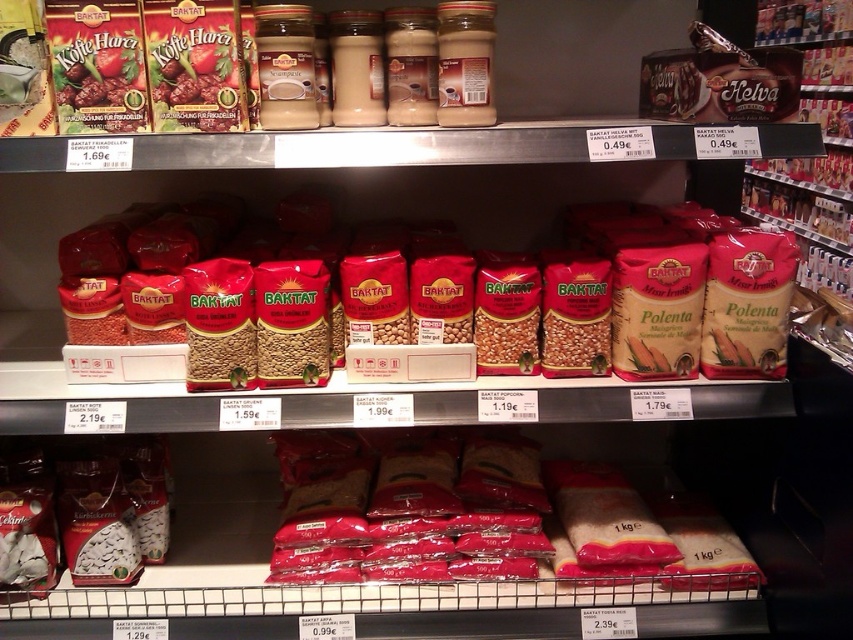
Question: Does red matte beans at center have a smaller size compared to red matte rice at center?

Choices:
 (A) no
 (B) yes

Answer: (A)

Question: Which object is farther from the camera taking this photo?

Choices:
 (A) red matte beans at center
 (B) red matte rice at center

Answer: (B)

Question: Among these objects, which one is nearest to the camera?

Choices:
 (A) red matte rice at center
 (B) red matte beans at center

Answer: (B)

Question: Is red matte beans at center wider than red matte rice at center?

Choices:
 (A) no
 (B) yes

Answer: (B)

Question: Is the position of red matte beans at center more distant than that of red matte rice at center?

Choices:
 (A) yes
 (B) no

Answer: (B)